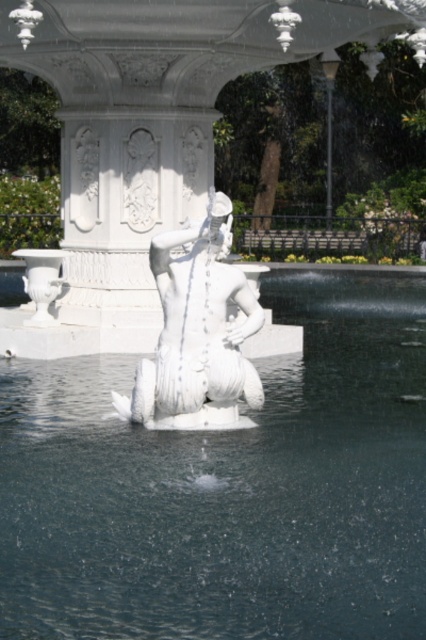
Question: Which of the following is the closest to the observer?

Choices:
 (A) (127, 556)
 (B) (206, 230)

Answer: (A)

Question: Among these points, which one is nearest to the camera?

Choices:
 (A) (189, 308)
 (B) (63, 452)

Answer: (B)

Question: Can you confirm if clear water at statue center is bigger than white marble statue at center?

Choices:
 (A) no
 (B) yes

Answer: (B)

Question: Is clear water at statue center smaller than white marble statue at center?

Choices:
 (A) yes
 (B) no

Answer: (B)

Question: From the image, what is the correct spatial relationship of clear water at statue center in relation to white marble statue at center?

Choices:
 (A) right
 (B) left

Answer: (A)